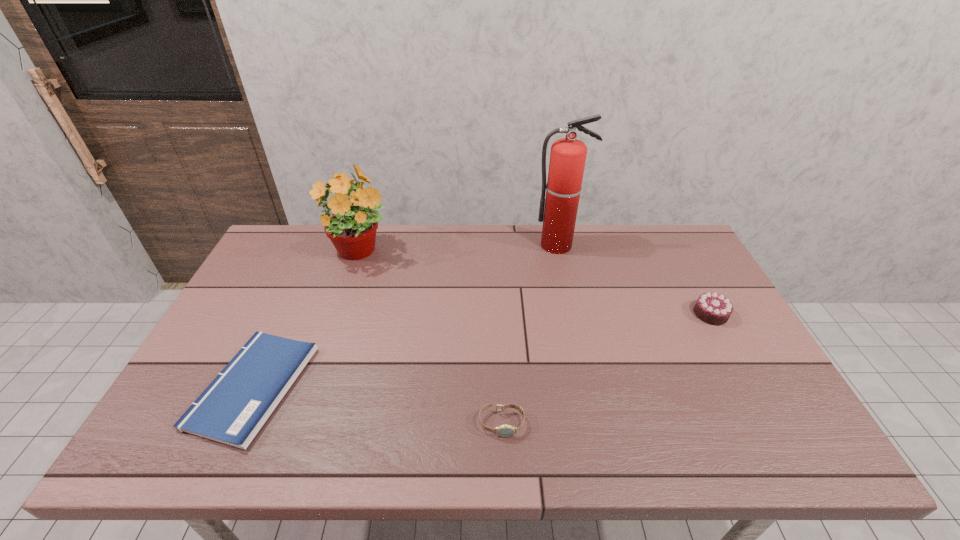
Locate an element on the screen. This screenshot has height=540, width=960. vacant region at the near edge of the desktop is located at coordinates (544, 431).

This screenshot has height=540, width=960. In order to click on vacant point at the left edge in this screenshot , I will do `click(253, 296)`.

The width and height of the screenshot is (960, 540). Identify the location of vacant space at the far left corner of the desktop. (287, 225).

Locate an element on the screen. This screenshot has width=960, height=540. free region at the far right corner of the desktop is located at coordinates (636, 231).

Find the location of `free spot between the tallest object and the watch`. free spot between the tallest object and the watch is located at coordinates (530, 334).

Locate an element on the screen. The width and height of the screenshot is (960, 540). vacant point located between the watch and the rightmost object is located at coordinates (606, 368).

You are a GUI agent. You are given a task and a screenshot of the screen. Output one action in this format:
    pyautogui.click(x=<x>, y=<y>)
    Task: Click on the free spot between the second tallest object and the fourth object from left to right
    This screenshot has height=540, width=960.
    Given the screenshot: What is the action you would take?
    pyautogui.click(x=458, y=249)

I want to click on free space that is in between the fourth tallest object and the paperback book, so click(x=377, y=405).

Find the location of a particular element. The image size is (960, 540). free spot between the third shortest object and the second shortest object is located at coordinates (606, 368).

I want to click on free space between the second tallest object and the paperback book, so click(x=306, y=320).